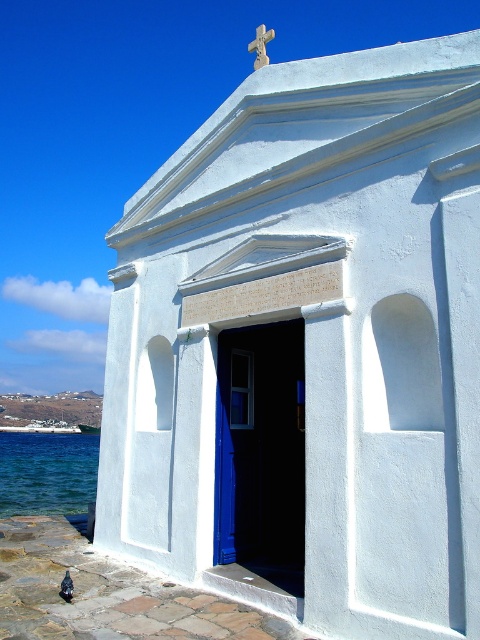
Looking at this image, you are a tourist visiting the chapel and want to take a photo that includes both the blue liquid water at lower left and the black feathered pigeon at lower left. Based on their positions, which object should you focus on first to ensure both are in frame?

The blue liquid water at lower left might be wider than the black feathered pigeon at lower left, so you should focus on the blue liquid water at lower left first to ensure both are in frame since it occupies more space.

You are standing at the entrance of the white Greek chapel by the sea. You notice a point marked at coordinates point (47,472). Based on the scene description, what does this point most likely represent?

The point (47,472) most likely represents the location of the blue liquid water at lower left.

You are a photographer standing in front of the chapel. You want to take a photo that includes both the stone textured cross at upper center and the black feathered pigeon at lower left. Which object will appear closer to the camera in the photo?

The stone textured cross at upper center will appear closer to the camera because it is further to the viewer than the black feathered pigeon at lower left.